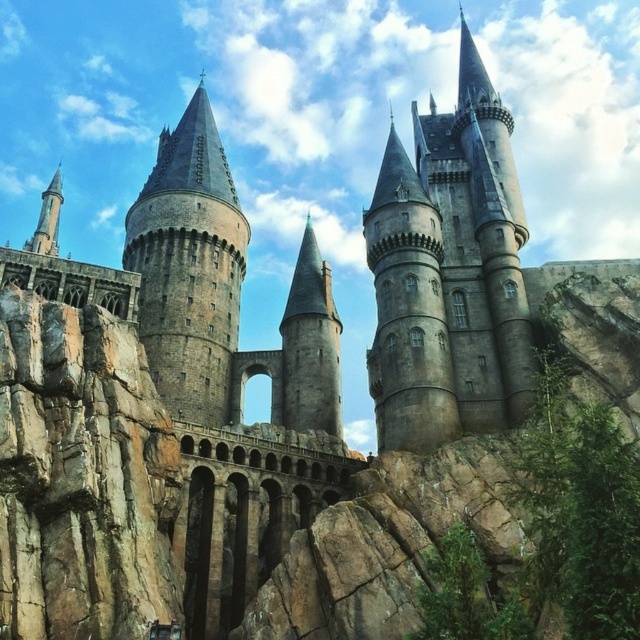
Describe the element at coordinates (449, 273) in the screenshot. I see `gray stone tower at center` at that location.

Between gray stone tower at center and stone gray tower at center, which one is positioned lower?

stone gray tower at center

The height and width of the screenshot is (640, 640). I want to click on gray stone tower at center, so click(449, 273).

What do you see at coordinates (449, 273) in the screenshot? Image resolution: width=640 pixels, height=640 pixels. I see `gray stone tower at center` at bounding box center [449, 273].

Between gray stone tower at center and smooth gray stone tower at center, which one is positioned higher?

gray stone tower at center is above.

Is point (496, 196) closer to viewer compared to point (282, 316)?

Yes, point (496, 196) is closer to viewer.

At what (x,y) coordinates should I click in order to perform the action: click on gray stone tower at center. Please return your answer as a coordinate pair (x, y). The width and height of the screenshot is (640, 640). Looking at the image, I should click on (449, 273).

Between point (195, 397) and point (316, 253), which one is positioned behind?

The point (316, 253) is behind.

Is stone gray tower at center to the left of smooth gray stone tower at center from the viewer's perspective?

Indeed, stone gray tower at center is positioned on the left side of smooth gray stone tower at center.

Who is more distant from viewer, (227, 342) or (336, 371)?

Positioned behind is point (227, 342).

Image resolution: width=640 pixels, height=640 pixels. In order to click on stone gray tower at center in this screenshot , I will do `click(188, 266)`.